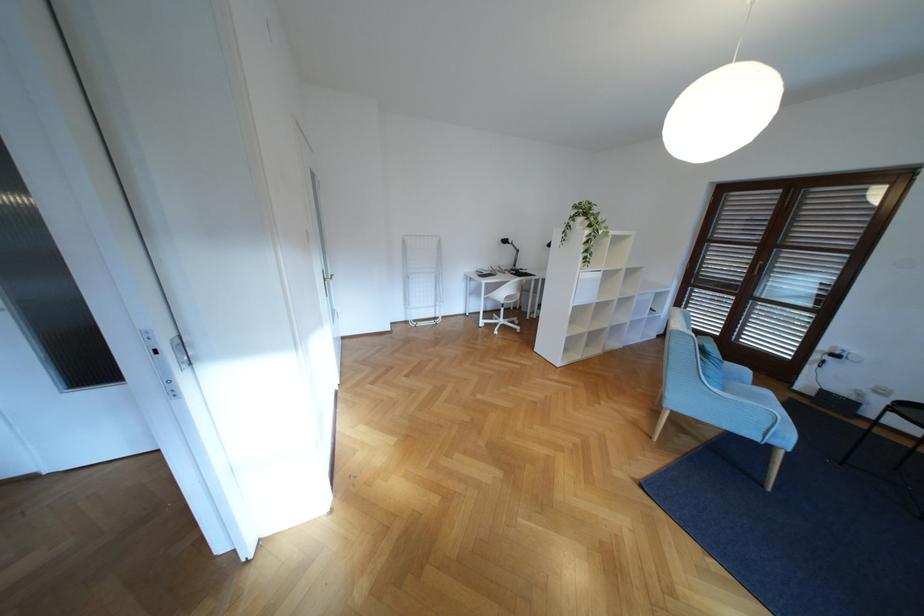
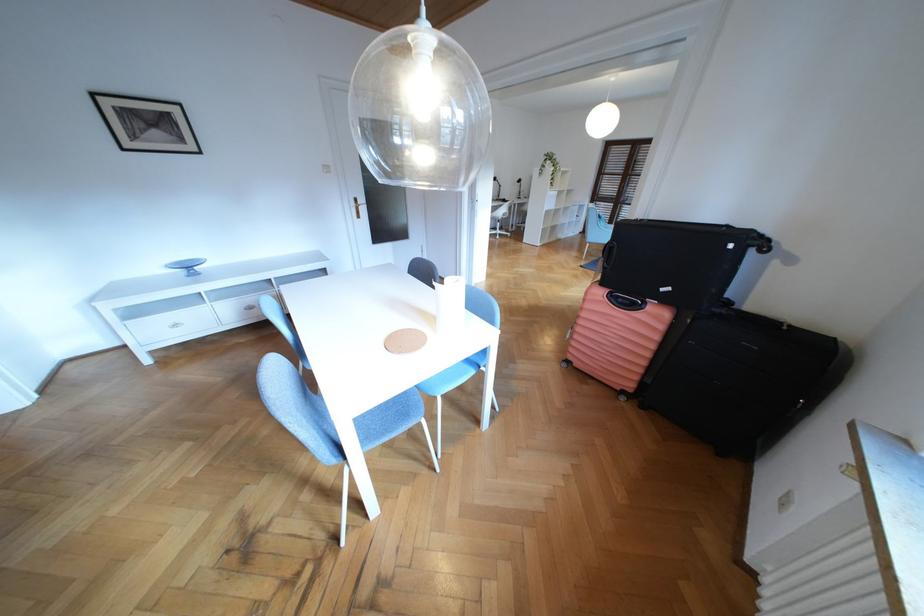
The images are taken continuously from a first-person perspective. In which direction are you moving?

The cameraman walked toward left, backward.